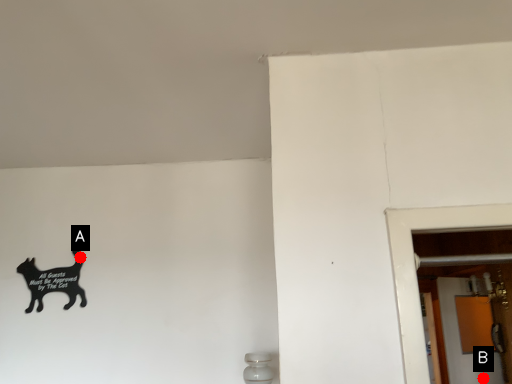
Question: Two points are circled on the image, labeled by A and B beside each circle. Which of the following is the closest to the observer?

Choices:
 (A) A is closer
 (B) B is closer

Answer: (A)